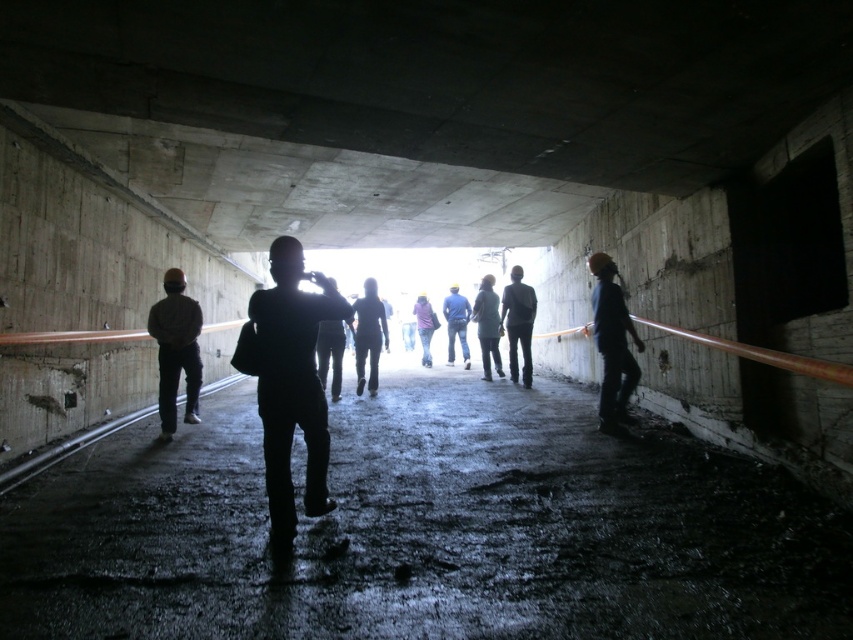
Is dark gray fabric jacket at left further to the viewer compared to silhouette jacket at center?

No, dark gray fabric jacket at left is closer to the viewer.

Can you confirm if dark gray fabric jacket at left is positioned above silhouette jacket at center?

Correct, dark gray fabric jacket at left is located above silhouette jacket at center.

Does point (158, 410) come behind point (318, 353)?

No, it is not.

Locate an element on the screen. The width and height of the screenshot is (853, 640). dark gray fabric jacket at left is located at coordinates (177, 349).

Between silhouette fabric at center and hard hat at right, which one appears on the right side from the viewer's perspective?

hard hat at right is more to the right.

The image size is (853, 640). I want to click on silhouette fabric at center, so click(x=292, y=381).

Is silhouette fabric at center to the right of dark blue jeans at center from the viewer's perspective?

In fact, silhouette fabric at center is to the left of dark blue jeans at center.

Which is in front, point (279, 241) or point (512, 352)?

Point (279, 241)

What are the coordinates of `silhouette fabric at center` in the screenshot? It's located at tap(292, 381).